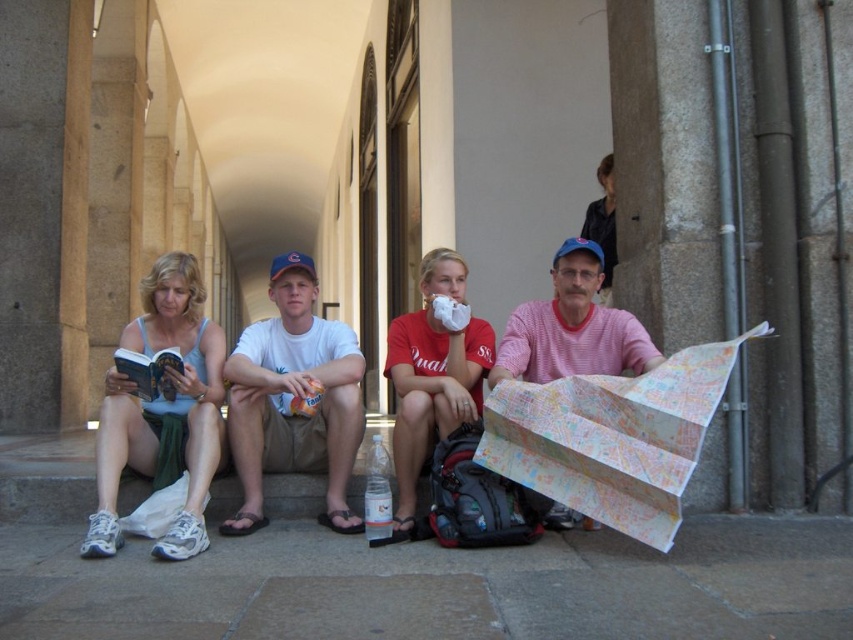
Question: Among these points, which one is farthest from the camera?

Choices:
 (A) coord(483,321)
 (B) coord(550,308)

Answer: (A)

Question: Can you confirm if white cotton t-shirt at center is positioned below matte red t-shirt at center?

Choices:
 (A) yes
 (B) no

Answer: (B)

Question: Can you confirm if matte blue tank top at left is positioned to the left of matte red t-shirt at center?

Choices:
 (A) yes
 (B) no

Answer: (A)

Question: Which point is farther to the camera?

Choices:
 (A) (193, 353)
 (B) (570, 362)
 (C) (451, 396)

Answer: (A)

Question: Is white cotton t-shirt at center wider than matte red t-shirt at center?

Choices:
 (A) no
 (B) yes

Answer: (B)

Question: Considering the real-world distances, which object is closest to the matte blue tank top at left?

Choices:
 (A) white cotton t-shirt at center
 (B) matte red t-shirt at center

Answer: (A)